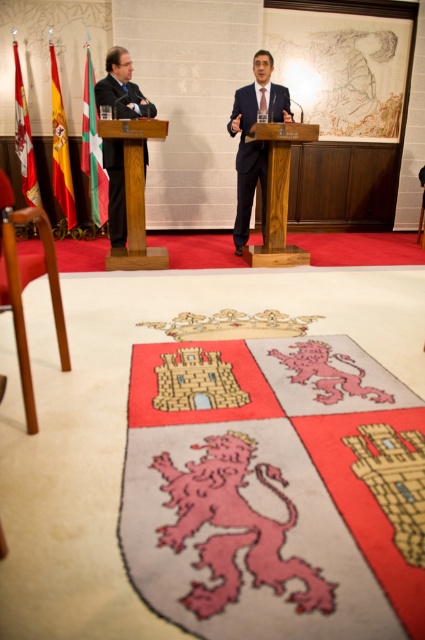
Between wooden podium at center and matte black suit at left, which one is positioned higher?

matte black suit at left is above.

Between wooden podium at center and matte black suit at left, which one is positioned lower?

wooden podium at center is lower down.

Find the location of a particular element. The width and height of the screenshot is (425, 640). wooden podium at center is located at coordinates (277, 193).

Is point (234, 113) positioned behind point (266, 262)?

No, it is not.

Which of these two, matte black suit at center or wooden podium at center, stands taller?

With more height is matte black suit at center.

Does point (240, 184) come closer to viewer compared to point (277, 180)?

No, it is behind (277, 180).

The height and width of the screenshot is (640, 425). I want to click on matte black suit at center, so click(x=255, y=141).

Does matte black suit at center have a lesser width compared to green fabric flag at left?

No.

Where is `matte black suit at center`? matte black suit at center is located at coordinates (255, 141).

Find the location of a particular element. The image size is (425, 640). matte black suit at center is located at coordinates (255, 141).